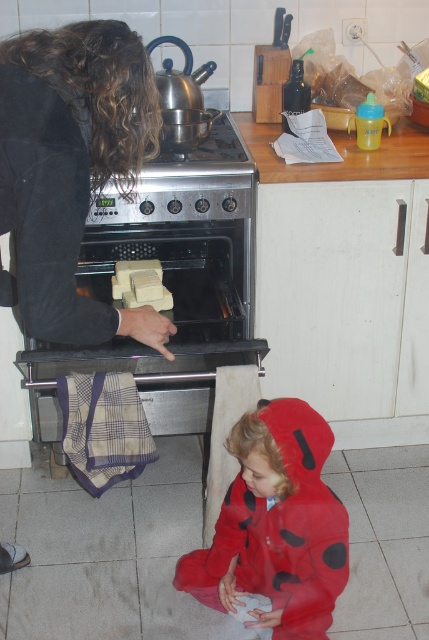
Question: Is stainless steel oven at center below red fuzzy coat at lower center?

Choices:
 (A) no
 (B) yes

Answer: (A)

Question: Which object appears farthest from the camera in this image?

Choices:
 (A) stainless steel oven at center
 (B) yellow soft cheese at oven center

Answer: (B)

Question: Which is farther from the stainless steel oven at center?

Choices:
 (A) yellow soft cheese at oven center
 (B) red fuzzy coat at lower center

Answer: (B)

Question: Which of the following is the farthest from the observer?

Choices:
 (A) (220, 598)
 (B) (157, 273)

Answer: (B)

Question: Can you confirm if red fuzzy coat at lower center is smaller than yellow soft cheese at oven center?

Choices:
 (A) no
 (B) yes

Answer: (A)

Question: Is red fuzzy coat at lower center above yellow soft cheese at oven center?

Choices:
 (A) no
 (B) yes

Answer: (A)